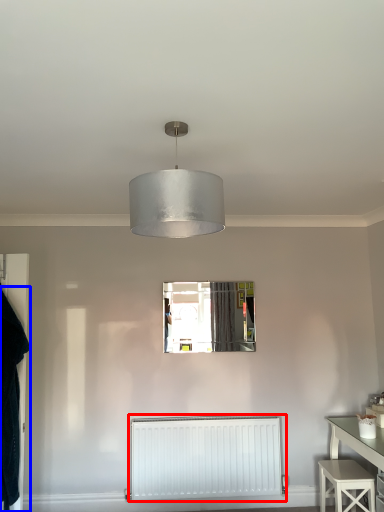
Question: Which point is further to the camera, radiator (highlighted by a red box) or clothing (highlighted by a blue box)?

Choices:
 (A) radiator
 (B) clothing

Answer: (A)